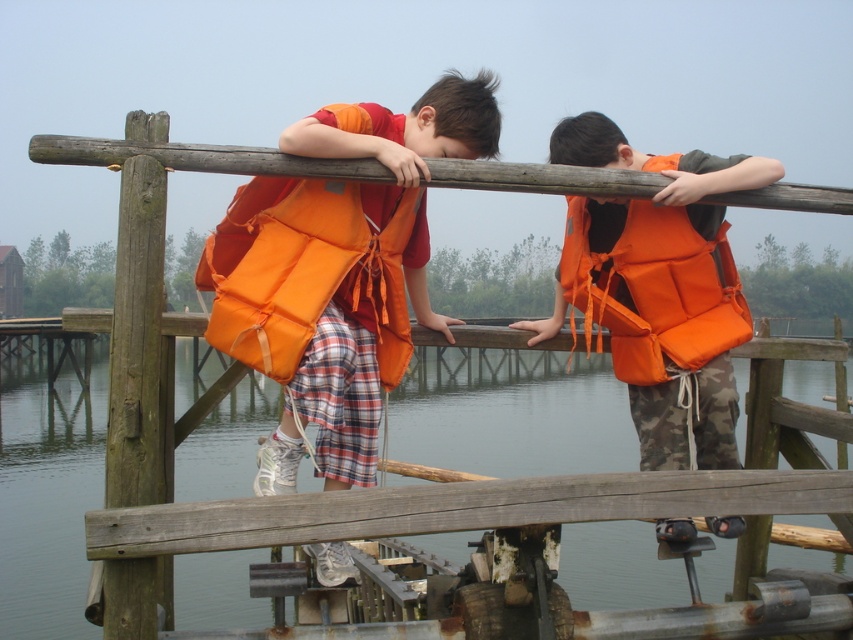
Looking at this image, which is below, orange matte life jacket at upper center or smooth wooden beam at center?

smooth wooden beam at center is below.

Who is more forward, [311,262] or [654,512]?

Positioned in front is point [654,512].

At what (x,y) coordinates should I click in order to perform the action: click on orange matte life jacket at upper center. Please return your answer as a coordinate pair (x, y). This screenshot has width=853, height=640. Looking at the image, I should click on (311, 268).

In order to click on orange matte life jacket at upper center in this screenshot , I will do `click(311, 268)`.

Does smooth wooden beam at center have a greater width compared to orange fabric life jacket at upper right?

Correct, the width of smooth wooden beam at center exceeds that of orange fabric life jacket at upper right.

Between smooth wooden beam at center and orange fabric life jacket at upper right, which one appears on the left side from the viewer's perspective?

From the viewer's perspective, smooth wooden beam at center appears more on the left side.

Image resolution: width=853 pixels, height=640 pixels. What do you see at coordinates (459, 508) in the screenshot?
I see `smooth wooden beam at center` at bounding box center [459, 508].

The height and width of the screenshot is (640, 853). Find the location of `smooth wooden beam at center`. smooth wooden beam at center is located at coordinates (459, 508).

Is point (686, 268) in front of point (393, 333)?

That is False.

Can you confirm if orange life vest at upper right is smaller than orange matte life jacket at upper center?

No, orange life vest at upper right is not smaller than orange matte life jacket at upper center.

At what (x,y) coordinates should I click in order to perform the action: click on orange life vest at upper right. Please return your answer as a coordinate pair (x, y). The height and width of the screenshot is (640, 853). Looking at the image, I should click on point(659,289).

At what (x,y) coordinates should I click in order to perform the action: click on orange life vest at upper right. Please return your answer as a coordinate pair (x, y). Looking at the image, I should click on (659, 289).